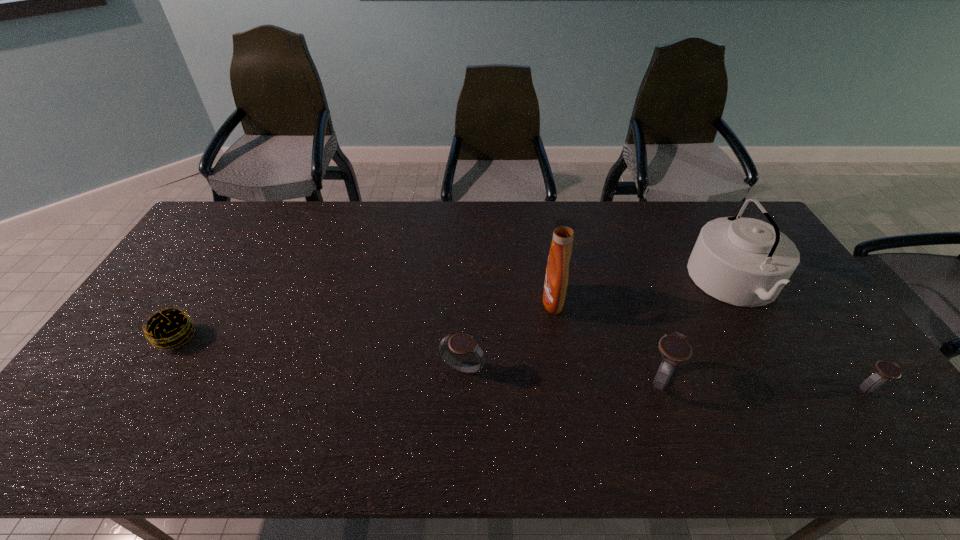
I want to click on free area in between the leftmost object and the fifth shortest object, so click(x=456, y=310).

You are a GUI agent. You are given a task and a screenshot of the screen. Output one action in this format:
    pyautogui.click(x=<x>, y=<y>)
    Task: Click on the free space that is in between the kettle and the second watch from left to right
    
    Given the screenshot: What is the action you would take?
    pyautogui.click(x=699, y=331)

Identify the location of vacant region between the patty and the tallest watch. (419, 358).

I want to click on empty location between the leftmost object and the shortest watch, so coord(521,363).

The width and height of the screenshot is (960, 540). Identify the location of vacant region between the leftmost object and the shortest watch. (521, 363).

This screenshot has width=960, height=540. Find the location of `free area in between the detergent and the fourth shortest object`. free area in between the detergent and the fourth shortest object is located at coordinates (607, 340).

The image size is (960, 540). In order to click on unoccupied area between the third object from left to right and the fifth shortest object in this screenshot , I will do pyautogui.click(x=644, y=292).

The image size is (960, 540). Identify the location of empty space that is in between the rightmost watch and the leftmost object. (521, 363).

The image size is (960, 540). Identify the location of object that is the fifth closest one to the kettle. (168, 328).

At what (x,y) coordinates should I click in order to perform the action: click on object that can be found as the fifth closest to the fourth object from right to left. Please return your answer as a coordinate pair (x, y). The image size is (960, 540). Looking at the image, I should click on (168, 328).